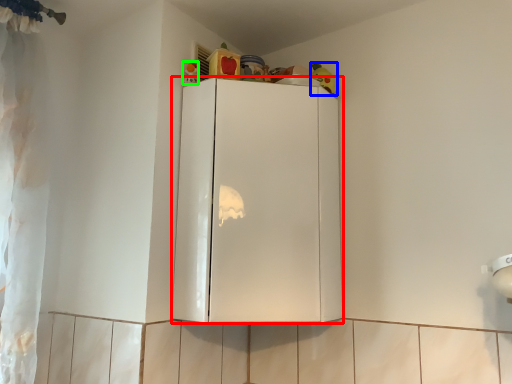
Question: Considering the real-world distances, which object is closest to cabinetry (highlighted by a red box)? toy (highlighted by a blue box) or toy (highlighted by a green box).

Choices:
 (A) toy
 (B) toy

Answer: (B)